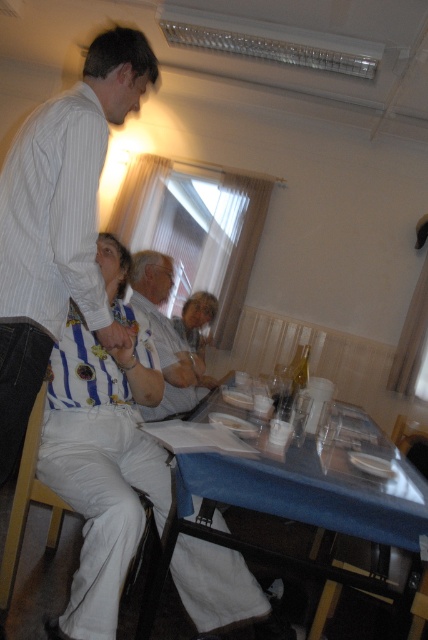
Who is lower down, blue fabric table at lower center or matte white hair at center?

blue fabric table at lower center is lower down.

Is point (363, 426) closer to viewer compared to point (211, 316)?

Yes, it is.

This screenshot has width=428, height=640. Find the location of `blue fabric table at lower center`. blue fabric table at lower center is located at coordinates (318, 484).

Which of these two, white striped shirt at upper left or blue fabric table at lower center, stands shorter?

blue fabric table at lower center

Which is in front, point (47, 124) or point (398, 477)?

Point (47, 124) is in front.

Does point (29, 220) come behind point (348, 413)?

No, (29, 220) is closer to viewer.

The width and height of the screenshot is (428, 640). I want to click on white striped shirt at upper left, so click(59, 221).

Can you confirm if light gray shirt at center is positioned above wooden at lower right?

Yes.

Describe the element at coordinates (166, 337) in the screenshot. This screenshot has width=428, height=640. I see `light gray shirt at center` at that location.

Is point (131, 257) positioned behind point (312, 627)?

Yes, point (131, 257) is behind point (312, 627).

The width and height of the screenshot is (428, 640). Find the location of `light gray shirt at center`. light gray shirt at center is located at coordinates (166, 337).